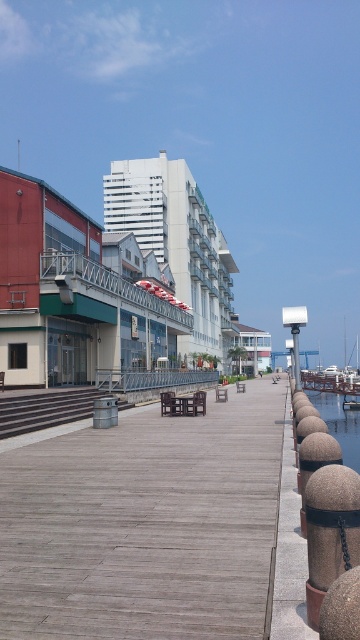
The image size is (360, 640). Identify the location of white glossy building at center. (177, 243).

Can you confirm if white glossy building at center is positioned above clear water at lower right?

Yes.

The height and width of the screenshot is (640, 360). In order to click on white glossy building at center in this screenshot , I will do (x=177, y=243).

Locate an element on the screen. white glossy building at center is located at coordinates (177, 243).

Is metallic rail at center positioned behind silver metallic rail at center?

That is False.

Is point (129, 284) positioned in front of point (135, 381)?

That is False.

Measure the distance between point (119, 284) and camera.

Point (119, 284) and camera are 41.99 meters apart from each other.

Where is `metallic rail at center`? The width and height of the screenshot is (360, 640). metallic rail at center is located at coordinates (110, 284).

Is white glossy building at center smaller than wooden dock at center?

Actually, white glossy building at center might be larger than wooden dock at center.

You are a GUI agent. You are given a task and a screenshot of the screen. Output one action in this format:
    pyautogui.click(x=<x>, y=<y>)
    Task: Click on the white glossy building at center
    Image resolution: width=360 pixels, height=640 pixels.
    Given the screenshot: What is the action you would take?
    pyautogui.click(x=177, y=243)

Image resolution: width=360 pixels, height=640 pixels. I want to click on white glossy building at center, so click(x=177, y=243).